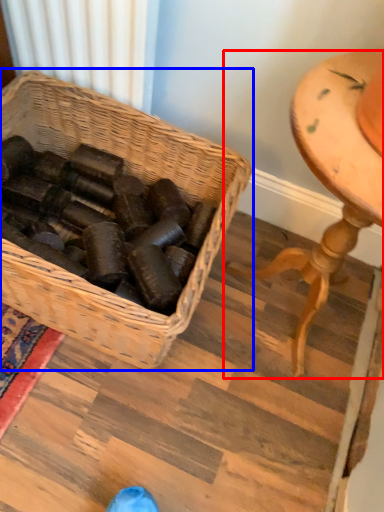
Question: Among these objects, which one is farthest to the camera, furniture (highlighted by a red box) or picnic basket (highlighted by a blue box)?

Choices:
 (A) furniture
 (B) picnic basket

Answer: (B)